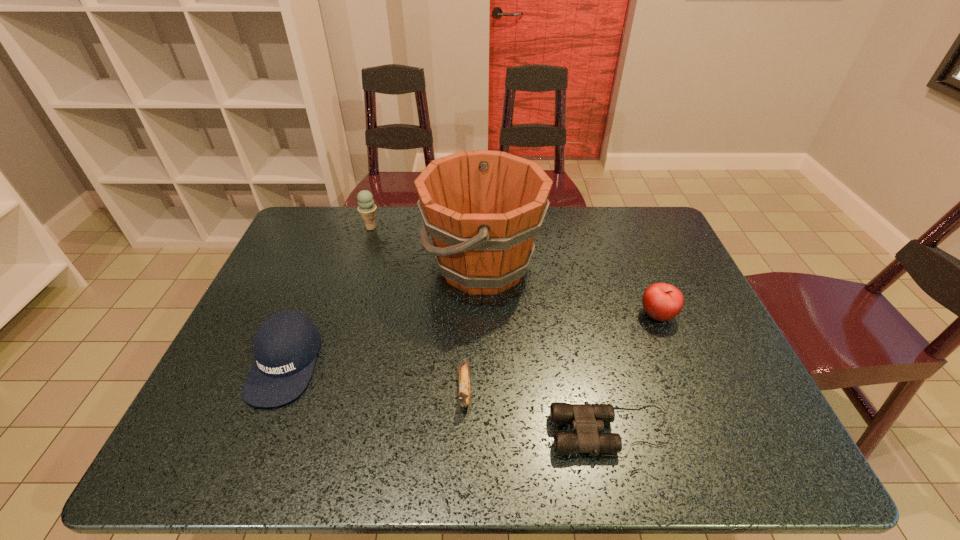
The width and height of the screenshot is (960, 540). Identify the location of unoccupied position between the shortest object and the bucket. (547, 349).

Where is `free spot between the baseball cap and the banana`? This screenshot has height=540, width=960. free spot between the baseball cap and the banana is located at coordinates (375, 377).

At what (x,y) coordinates should I click in order to perform the action: click on unoccupied area between the ice cream and the banana. Please return your answer as a coordinate pair (x, y). The height and width of the screenshot is (540, 960). Looking at the image, I should click on (418, 309).

Where is `vacant space that is in between the baseball cap and the second shortest object`? Image resolution: width=960 pixels, height=540 pixels. vacant space that is in between the baseball cap and the second shortest object is located at coordinates click(x=375, y=377).

Point out which object is positioned as the third nearest to the bucket. Please provide its 2D coordinates. Your answer should be formatted as a tuple, i.e. [(x, y)], where the tuple contains the x and y coordinates of a point satisfying the conditions above.

[(285, 346)]

Find the location of a particular element. The width and height of the screenshot is (960, 540). the fifth closest object to the baseball cap is located at coordinates (661, 301).

Locate an element on the screen. free space that satisfies the following two spatial constraints: 1. on the handle side of the bucket; 2. at the stem of the fifth tallest object is located at coordinates (484, 391).

The image size is (960, 540). Find the location of `free location that satisfies the following two spatial constraints: 1. on the handle side of the tallest object; 2. on the right side of the rightmost object`. free location that satisfies the following two spatial constraints: 1. on the handle side of the tallest object; 2. on the right side of the rightmost object is located at coordinates (484, 315).

Find the location of a particular element. This screenshot has height=540, width=960. vacant space that satisfies the following two spatial constraints: 1. on the handle side of the apple; 2. on the right side of the bucket is located at coordinates (484, 315).